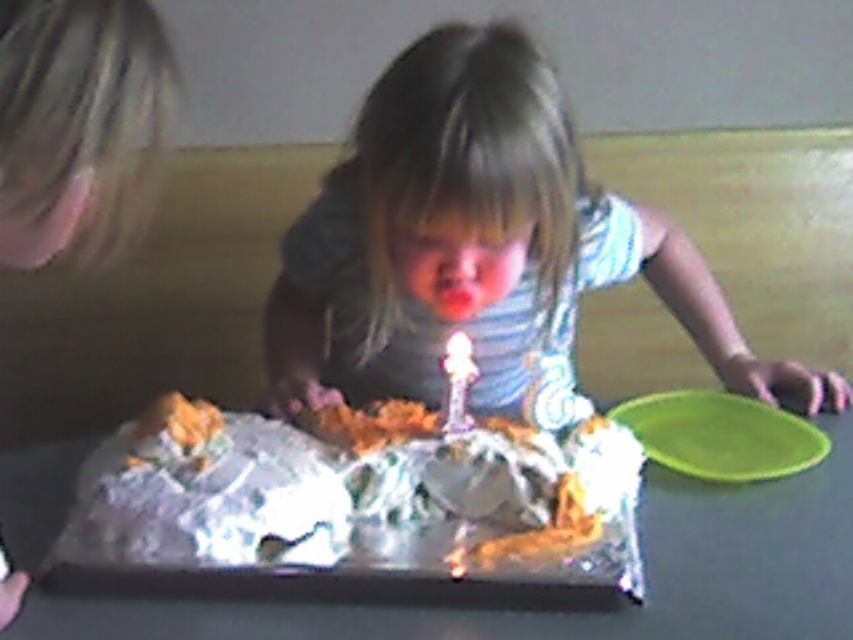
Question: Which of the following is the closest to the observer?

Choices:
 (A) (677, 449)
 (B) (444, 422)
 (C) (572, 132)

Answer: (C)

Question: Considering the real-world distances, which object is closest to the white plastic candle at center?

Choices:
 (A) striped fabric shirt at center
 (B) shiny aluminum tray at center

Answer: (A)

Question: Which of these objects is positioned closest to the shiny aluminum tray at center?

Choices:
 (A) white plastic candle at center
 (B) green plastic plate at lower right
 (C) striped fabric shirt at center

Answer: (B)

Question: Considering the relative positions of shiny aluminum tray at center and white plastic candle at center in the image provided, where is shiny aluminum tray at center located with respect to white plastic candle at center?

Choices:
 (A) right
 (B) left

Answer: (B)

Question: Is shiny aluminum tray at center behind white plastic candle at center?

Choices:
 (A) yes
 (B) no

Answer: (B)

Question: Is striped fabric shirt at center below white plastic candle at center?

Choices:
 (A) yes
 (B) no

Answer: (B)